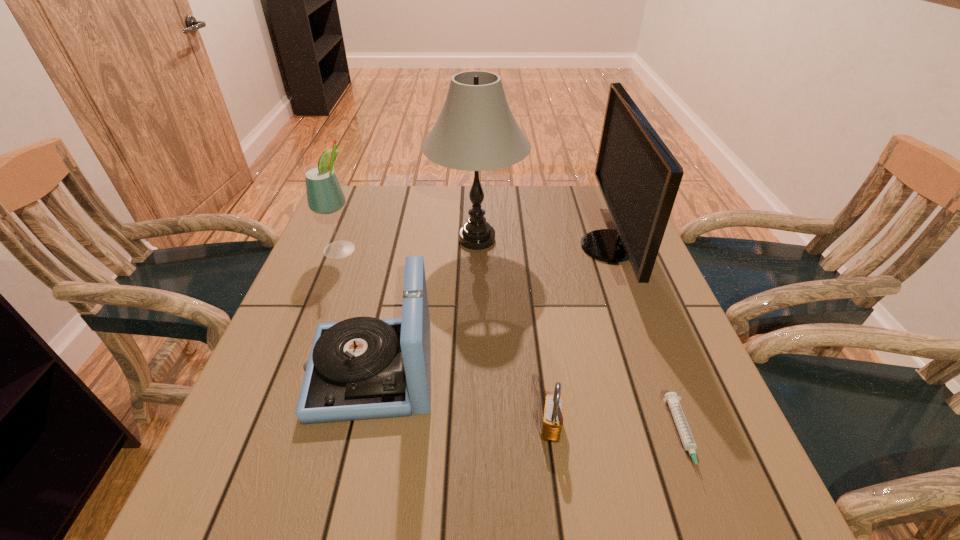
The width and height of the screenshot is (960, 540). I want to click on blank space located on the right of the fourth shortest object, so click(x=404, y=248).

In order to click on free space located 0.110m on the back of the third shortest object in this screenshot , I will do `click(390, 294)`.

At what (x,y) coordinates should I click in order to perform the action: click on free spot located on the back of the padlock. Please return your answer as a coordinate pair (x, y). The height and width of the screenshot is (540, 960). Looking at the image, I should click on (531, 273).

Where is `free location located at the needle end of the shortest object`? This screenshot has width=960, height=540. free location located at the needle end of the shortest object is located at coordinates (718, 531).

In order to click on lamp located in the far edge section of the desktop in this screenshot , I will do `click(476, 131)`.

Where is `computer monitor that is positioned at the far edge`? This screenshot has height=540, width=960. computer monitor that is positioned at the far edge is located at coordinates (639, 178).

This screenshot has height=540, width=960. Identify the location of object that is positioned at the near edge. (671, 398).

This screenshot has height=540, width=960. In order to click on alcohol at the left edge in this screenshot , I will do `click(324, 194)`.

This screenshot has height=540, width=960. Find the location of `phonograph record located at the left edge`. phonograph record located at the left edge is located at coordinates (362, 368).

Locate an element on the screen. This screenshot has width=960, height=540. computer monitor present at the right edge is located at coordinates (639, 178).